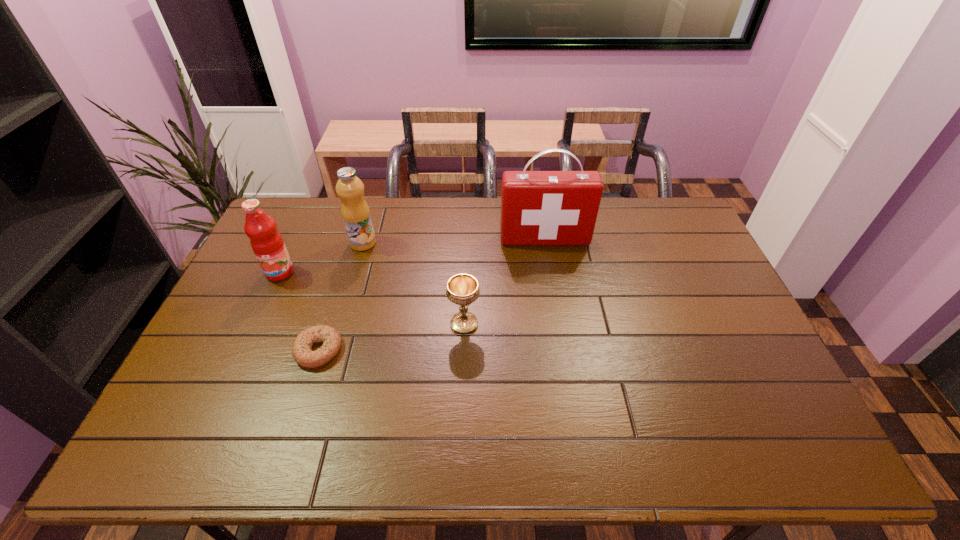
Where is `free region located on the front label of the nearer fruit juice`? The height and width of the screenshot is (540, 960). free region located on the front label of the nearer fruit juice is located at coordinates (250, 338).

Where is `vacant space located on the back of the second shortest object`? The image size is (960, 540). vacant space located on the back of the second shortest object is located at coordinates (467, 237).

Where is `free space located on the front of the shortest object`? The image size is (960, 540). free space located on the front of the shortest object is located at coordinates click(306, 390).

In order to click on the first-aid kit present at the far edge in this screenshot , I will do `click(537, 207)`.

Identify the location of fruit juice that is at the far edge. (355, 211).

In order to click on object situated at the left edge in this screenshot , I will do `click(266, 241)`.

Where is `free location at the far edge`? This screenshot has height=540, width=960. free location at the far edge is located at coordinates (419, 206).

The height and width of the screenshot is (540, 960). I want to click on vacant space at the near edge, so click(569, 430).

Locate an element on the screen. The image size is (960, 540). free space at the left edge of the desktop is located at coordinates (227, 406).

Locate an element on the screen. The width and height of the screenshot is (960, 540). vacant space at the right edge of the desktop is located at coordinates (708, 294).